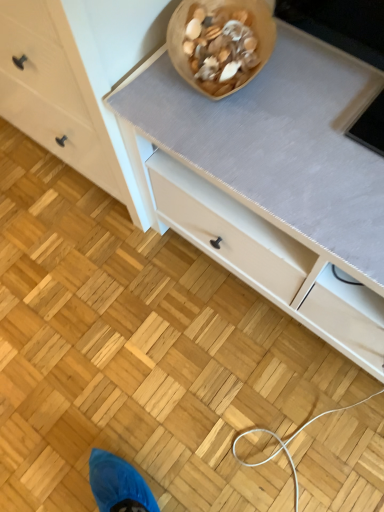
The image size is (384, 512). I want to click on free spot to the right of wooden bowl at upper center, so click(317, 70).